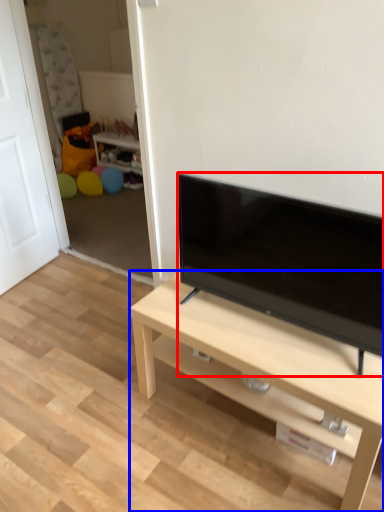
Question: Which object appears farthest to the camera in this image, television (highlighted by a red box) or desk (highlighted by a blue box)?

Choices:
 (A) television
 (B) desk

Answer: (B)